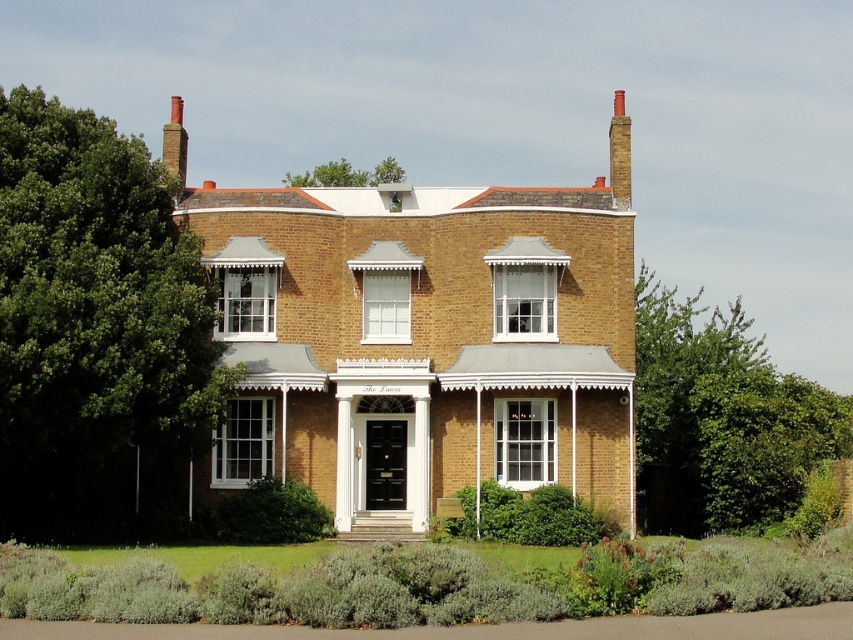
Is white wooden porch at center positioned behind green leafy tree at upper center?

No, it is not.

Between white wooden porch at center and green leafy tree at upper center, which one appears on the right side from the viewer's perspective?

Positioned to the right is white wooden porch at center.

Is point (405, 540) closer to viewer compared to point (367, 179)?

That is True.

Locate an element on the screen. white wooden porch at center is located at coordinates (381, 525).

From the picture: Between green leafy tree at left and white wooden porch at center, which one has more height?

green leafy tree at left

Does green leafy tree at left appear under white wooden porch at center?

Incorrect, green leafy tree at left is not positioned below white wooden porch at center.

Identify the location of green leafy tree at left. 96,330.

Locate an element on the screen. green leafy tree at left is located at coordinates (x=96, y=330).

Can you confirm if green leafy tree at center is shorter than green leafy tree at upper center?

No, green leafy tree at center is not shorter than green leafy tree at upper center.

Does green leafy tree at center have a greater width compared to green leafy tree at upper center?

Correct, the width of green leafy tree at center exceeds that of green leafy tree at upper center.

Locate an element on the screen. The width and height of the screenshot is (853, 640). green leafy tree at center is located at coordinates (720, 419).